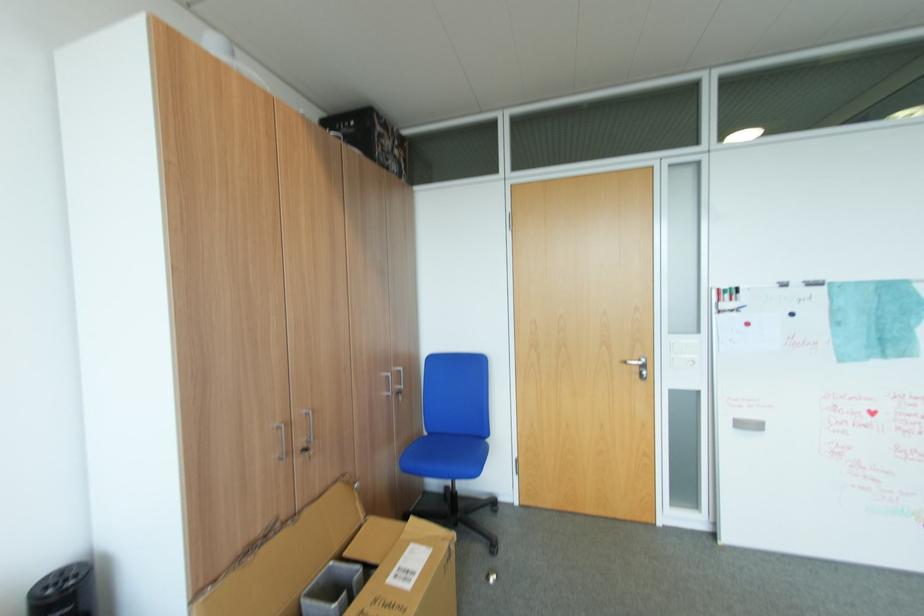
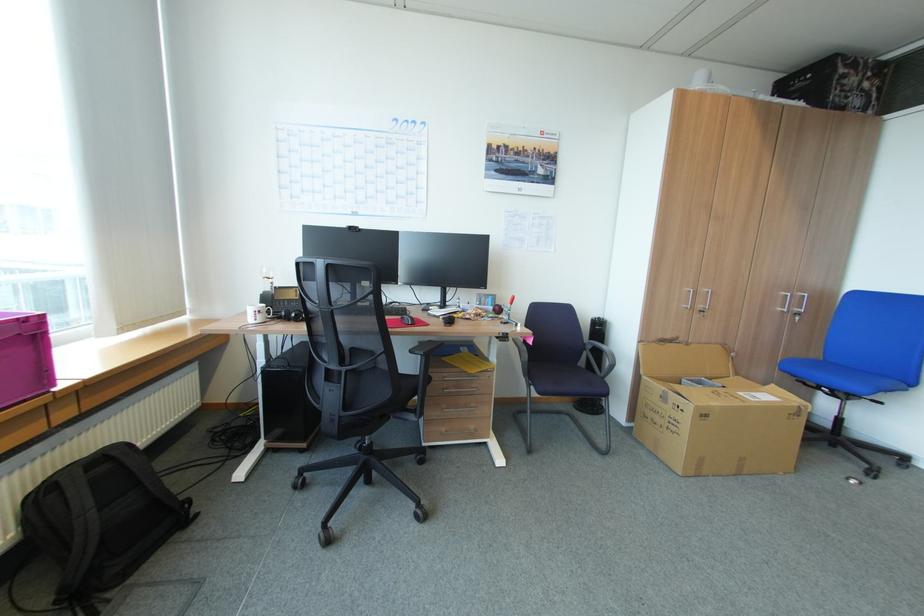
Locate, in the second image, the point that corresponds to pixel 409 469 in the first image.

(786, 370)